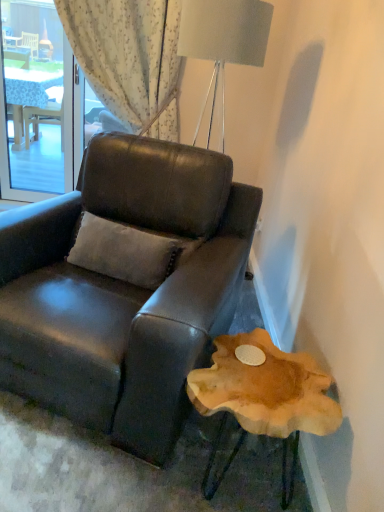
Identify the location of matte black leather chair at center. The image size is (384, 512). (124, 286).

Identify the location of transparent glass window at upper left. (35, 102).

The image size is (384, 512). Identify the location of suede-like beige pillow at center. (123, 252).

From the image's perspective, who appears lower, matte black leather chair at center or suede-like beige pillow at center?

matte black leather chair at center, from the image's perspective.

Where is `pillow on the right of matte black leather chair at center`? This screenshot has height=512, width=384. pillow on the right of matte black leather chair at center is located at coordinates pyautogui.click(x=123, y=252).

From a real-world perspective, is matte black leather chair at center located beneath suede-like beige pillow at center?

Yes.

Are matte black leather chair at center and suede-like beige pillow at center beside each other?

No, matte black leather chair at center is not in contact with suede-like beige pillow at center.

The height and width of the screenshot is (512, 384). Identify the location of chair that is above the natural wood side table at lower right (from a real-world perspective). (124, 286).

Which object is positioned more to the right, matte black leather chair at center or natural wood side table at lower right?

From the viewer's perspective, natural wood side table at lower right appears more on the right side.

Measure the distance from matte black leather chair at center to natural wood side table at lower right.

matte black leather chair at center and natural wood side table at lower right are 16.83 inches apart.

Considering the relative sizes of matte black leather chair at center and natural wood side table at lower right in the image provided, is matte black leather chair at center smaller than natural wood side table at lower right?

No.

Is transparent glass window at upper left touching matte black leather chair at center?

No, transparent glass window at upper left is not making contact with matte black leather chair at center.

How different are the orientations of transparent glass window at upper left and matte black leather chair at center in degrees?

transparent glass window at upper left and matte black leather chair at center are facing 23.6 degrees away from each other.

Who is more distant, transparent glass window at upper left or matte black leather chair at center?

transparent glass window at upper left.

Between transparent glass window at upper left and natural wood side table at lower right, which one is positioned behind?

transparent glass window at upper left.

From the image's perspective, is transparent glass window at upper left on top of natural wood side table at lower right?

Yes.

Considering the points (23, 134) and (232, 350), which point is in front, point (23, 134) or point (232, 350)?

The point (232, 350) is more forward.

Considering the sizes of objects transparent glass window at upper left and natural wood side table at lower right in the image provided, who is bigger, transparent glass window at upper left or natural wood side table at lower right?

Bigger between the two is natural wood side table at lower right.

Does suede-like beige pillow at center have a lesser width compared to matte black leather chair at center?

Correct, the width of suede-like beige pillow at center is less than that of matte black leather chair at center.

Are suede-like beige pillow at center and matte black leather chair at center located far from each other?

No, suede-like beige pillow at center is in close proximity to matte black leather chair at center.

Based on the photo, from the image's perspective, is suede-like beige pillow at center beneath matte black leather chair at center?

No, from the image's perspective, suede-like beige pillow at center is not below matte black leather chair at center.

Considering the sizes of objects suede-like beige pillow at center and matte black leather chair at center in the image provided, who is smaller, suede-like beige pillow at center or matte black leather chair at center?

suede-like beige pillow at center is smaller.

In the scene shown: What's the angular difference between matte black leather chair at center and transparent glass window at upper left's facing directions?

23.6 degrees.

Is point (7, 220) less distant than point (3, 159)?

Yes, point (7, 220) is closer to viewer.

Who is bigger, matte black leather chair at center or transparent glass window at upper left?

With larger size is matte black leather chair at center.

From the picture: From a real-world perspective, between matte black leather chair at center and transparent glass window at upper left, who is vertically lower?

From a 3D spatial view, matte black leather chair at center is below.

From the picture: Which object is thinner, natural wood side table at lower right or transparent glass window at upper left?

transparent glass window at upper left.

How different are the orientations of natural wood side table at lower right and transparent glass window at upper left in degrees?

The facing directions of natural wood side table at lower right and transparent glass window at upper left are 12 degrees apart.

Are natural wood side table at lower right and transparent glass window at upper left beside each other?

No, natural wood side table at lower right is not with transparent glass window at upper left.

Looking at this image, between natural wood side table at lower right and transparent glass window at upper left, which one has less height?

natural wood side table at lower right is shorter.

Locate an element on the screen. Image resolution: width=384 pixels, height=512 pixels. pillow that appears above the matte black leather chair at center (from the image's perspective) is located at coordinates (123, 252).

Locate an element on the screen. This screenshot has height=512, width=384. chair in front of the natural wood side table at lower right is located at coordinates (124, 286).

Considering their positions, is suede-like beige pillow at center positioned closer to natural wood side table at lower right than matte black leather chair at center?

matte black leather chair at center lies closer to natural wood side table at lower right than the other object.

When comparing their distances from natural wood side table at lower right, does matte black leather chair at center or transparent glass window at upper left seem closer?

matte black leather chair at center.

Based on their spatial positions, is matte black leather chair at center or suede-like beige pillow at center further from natural wood side table at lower right?

suede-like beige pillow at center is further to natural wood side table at lower right.

From the image, which object appears to be farther from natural wood side table at lower right, transparent glass window at upper left or matte black leather chair at center?

Among the two, transparent glass window at upper left is located further to natural wood side table at lower right.

Which object lies nearer to the anchor point transparent glass window at upper left, matte black leather chair at center or natural wood side table at lower right?

The object closer to transparent glass window at upper left is matte black leather chair at center.

Estimate the real-world distances between objects in this image. Which object is further from suede-like beige pillow at center, natural wood side table at lower right or transparent glass window at upper left?

transparent glass window at upper left is positioned further to the anchor suede-like beige pillow at center.

From the image, which object appears to be nearer to suede-like beige pillow at center, transparent glass window at upper left or natural wood side table at lower right?

natural wood side table at lower right lies closer to suede-like beige pillow at center than the other object.

From the image, which object appears to be nearer to transparent glass window at upper left, natural wood side table at lower right or matte black leather chair at center?

Based on the image, matte black leather chair at center appears to be nearer to transparent glass window at upper left.

Where is `round table between matte black leather chair at center and transparent glass window at upper left along the z-axis`? The image size is (384, 512). round table between matte black leather chair at center and transparent glass window at upper left along the z-axis is located at coordinates (264, 388).

The width and height of the screenshot is (384, 512). Identify the location of pillow between natural wood side table at lower right and transparent glass window at upper left in the front-back direction. (123, 252).

In order to click on pillow positioned between matte black leather chair at center and transparent glass window at upper left from near to far in this screenshot , I will do `click(123, 252)`.

Where is `round table between matte black leather chair at center and suede-like beige pillow at center from front to back`? The width and height of the screenshot is (384, 512). round table between matte black leather chair at center and suede-like beige pillow at center from front to back is located at coordinates (264, 388).